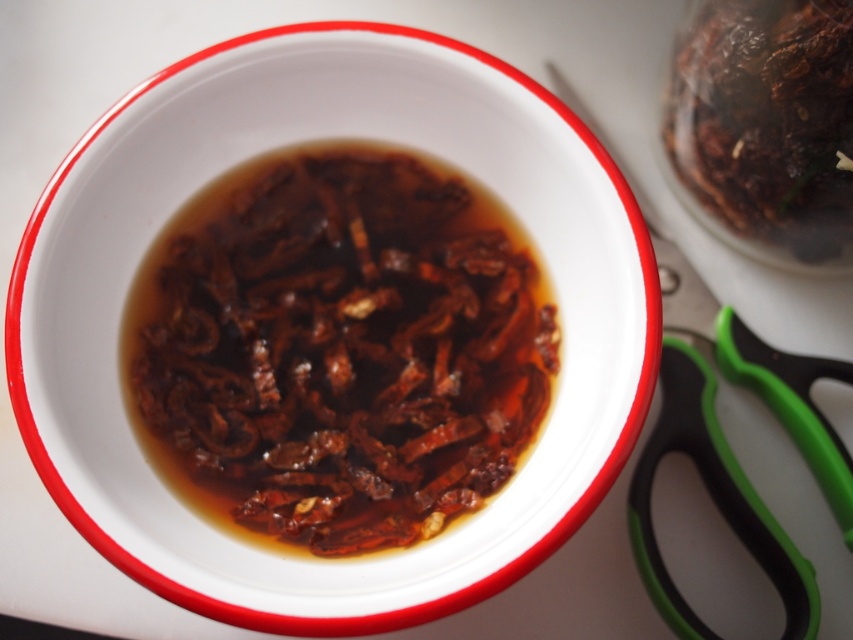
You are a food photographer and need to adjust the lighting to highlight the brown glossy dried chilies at center. Since the bowl is on a light surface, where should you place the main light source relative to the chilies to create a shadow pointing towards the bowl?

To create a shadow pointing towards the bowl, the main light source should be placed opposite to the direction of the shadow. Since the chilies are at position point (339, 348), the light should be positioned in a direction that casts the shadow toward the bowl. However, without knowing the exact orientation of the bowl or the direction the shadow needs to point, precise placement can be determined based on desired shadow direction.